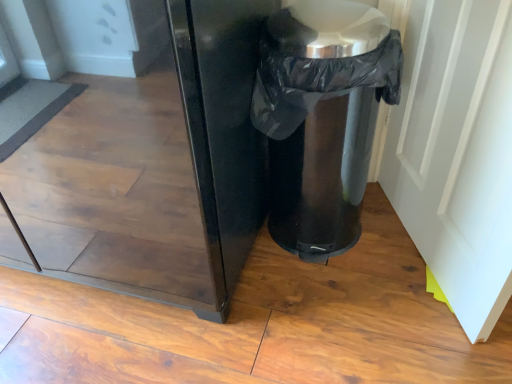
The width and height of the screenshot is (512, 384). In order to click on black plastic trash can at lower right in this screenshot , I will do `click(322, 119)`.

What do you see at coordinates (322, 119) in the screenshot?
I see `black plastic trash can at lower right` at bounding box center [322, 119].

What do you see at coordinates (457, 152) in the screenshot? I see `white glossy door at right` at bounding box center [457, 152].

This screenshot has height=384, width=512. I want to click on white glossy door at right, so click(457, 152).

I want to click on black plastic trash can at lower right, so click(322, 119).

Would you say black plastic trash can at lower right is to the left or to the right of white glossy door at right in the picture?

From the image, it's evident that black plastic trash can at lower right is to the left of white glossy door at right.

Considering the positions of objects black plastic trash can at lower right and white glossy door at right in the image provided, who is behind, black plastic trash can at lower right or white glossy door at right?

Positioned behind is black plastic trash can at lower right.

Is point (358, 223) closer to camera compared to point (489, 42)?

No.

From the image's perspective, is black plastic trash can at lower right above white glossy door at right?

Indeed, from the image's perspective, black plastic trash can at lower right is shown above white glossy door at right.

From a real-world perspective, who is located lower, black plastic trash can at lower right or white glossy door at right?

A: In real-world perspective, black plastic trash can at lower right is lower.

Does black plastic trash can at lower right have a lesser width compared to white glossy door at right?

No, black plastic trash can at lower right is not thinner than white glossy door at right.

Does black plastic trash can at lower right have a lesser height compared to white glossy door at right?

Correct, black plastic trash can at lower right is not as tall as white glossy door at right.

Is black plastic trash can at lower right bigger or smaller than white glossy door at right?

black plastic trash can at lower right is bigger than white glossy door at right.

Could white glossy door at right be considered to be inside black plastic trash can at lower right?

That's incorrect, white glossy door at right is not inside black plastic trash can at lower right.

Is black plastic trash can at lower right beside white glossy door at right?

There is a gap between black plastic trash can at lower right and white glossy door at right.

Does black plastic trash can at lower right turn towards white glossy door at right?

No, black plastic trash can at lower right is not aimed at white glossy door at right.

How different are the orientations of black plastic trash can at lower right and white glossy door at right in degrees?

113 degrees separate the facing orientations of black plastic trash can at lower right and white glossy door at right.

Find the location of `screen door below the black plastic trash can at lower right (from the image's perspective)`. screen door below the black plastic trash can at lower right (from the image's perspective) is located at coordinates (457, 152).

Considering the positions of objects white glossy door at right and black plastic trash can at lower right in the image provided, who is more to the right, white glossy door at right or black plastic trash can at lower right?

From the viewer's perspective, white glossy door at right appears more on the right side.

Considering the positions of objects white glossy door at right and black plastic trash can at lower right in the image provided, who is in front, white glossy door at right or black plastic trash can at lower right?

white glossy door at right is closer to the camera.

Between point (462, 291) and point (305, 1), which one is positioned in front?

Positioned in front is point (305, 1).

From the image's perspective, would you say white glossy door at right is positioned over black plastic trash can at lower right?

Incorrect, from the image's perspective, white glossy door at right is lower than black plastic trash can at lower right.

From a real-world perspective, which object stands above the other?

white glossy door at right.

In the scene shown: Considering the relative sizes of white glossy door at right and black plastic trash can at lower right in the image provided, is white glossy door at right thinner than black plastic trash can at lower right?

Yes, white glossy door at right is thinner than black plastic trash can at lower right.

Considering the relative sizes of white glossy door at right and black plastic trash can at lower right in the image provided, is white glossy door at right shorter than black plastic trash can at lower right?

No, white glossy door at right is not shorter than black plastic trash can at lower right.

Considering the relative sizes of white glossy door at right and black plastic trash can at lower right in the image provided, is white glossy door at right bigger than black plastic trash can at lower right?

No.

Is black plastic trash can at lower right surrounded by white glossy door at right?

No, white glossy door at right does not contain black plastic trash can at lower right.

Is white glossy door at right next to black plastic trash can at lower right?

white glossy door at right is not next to black plastic trash can at lower right, and they're not touching.

Is white glossy door at right aimed at black plastic trash can at lower right?

Yes, white glossy door at right is facing black plastic trash can at lower right.

How many degrees apart are the facing directions of white glossy door at right and black plastic trash can at lower right?

They differ by 113 degrees in their facing directions.

This screenshot has height=384, width=512. Find the location of `waste container on the left of white glossy door at right`. waste container on the left of white glossy door at right is located at coordinates (322, 119).

Locate an element on the screen. screen door below the black plastic trash can at lower right (from the image's perspective) is located at coordinates (457, 152).

Where is `waste container lying above the white glossy door at right (from the image's perspective)`? Image resolution: width=512 pixels, height=384 pixels. waste container lying above the white glossy door at right (from the image's perspective) is located at coordinates (322, 119).